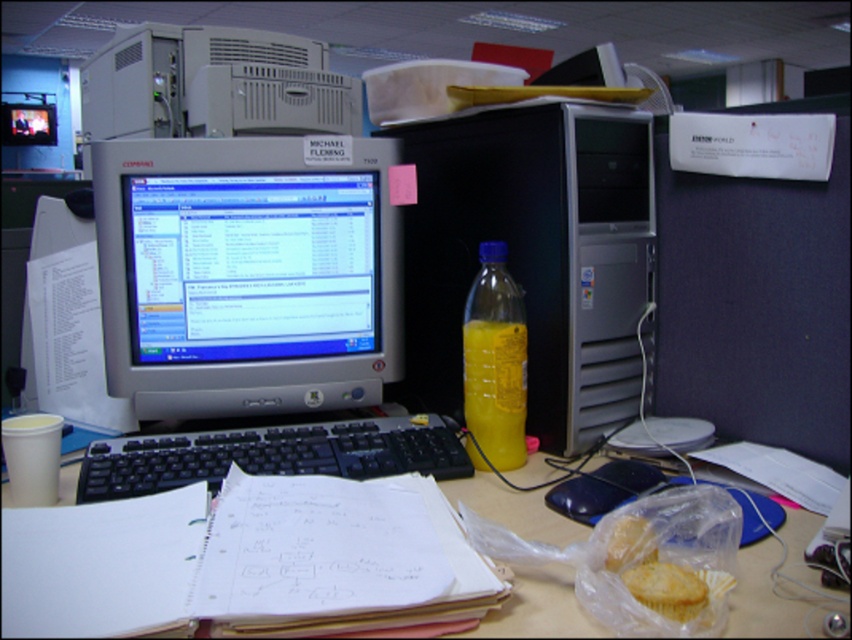
Question: Which point is farther to the camera?

Choices:
 (A) silver plastic monitor at center
 (B) yellow cake at lower right
 (C) yellow translucent bottle at center
 (D) translucent plastic table at center

Answer: (A)

Question: Considering the relative positions of black plastic keyboard at center and yellow translucent bottle at center in the image provided, where is black plastic keyboard at center located with respect to yellow translucent bottle at center?

Choices:
 (A) below
 (B) above

Answer: (A)

Question: Where is yellow translucent bottle at center located in relation to yellow cake at lower right in the image?

Choices:
 (A) right
 (B) left

Answer: (B)

Question: Among these objects, which one is nearest to the camera?

Choices:
 (A) yellow translucent bottle at center
 (B) black plastic keyboard at center

Answer: (B)

Question: Estimate the real-world distances between objects in this image. Which object is closer to the satin silver computer tower at center?

Choices:
 (A) silver plastic monitor at center
 (B) yellow cake at lower right
 (C) translucent plastic table at center

Answer: (A)

Question: Can you confirm if silver plastic monitor at center is positioned to the right of translucent plastic table at center?

Choices:
 (A) yes
 (B) no

Answer: (B)